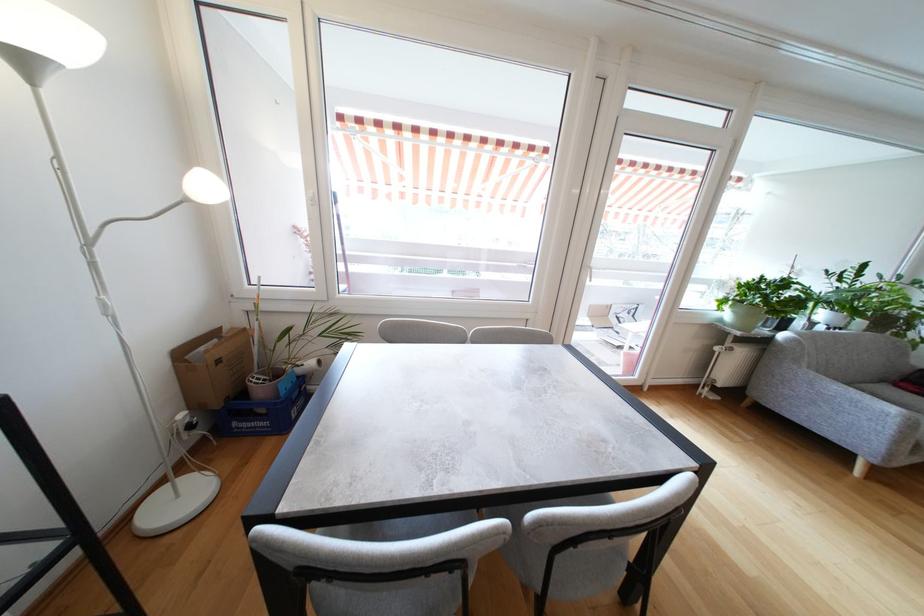
I want to click on flexible lamp arm, so click(x=124, y=231).